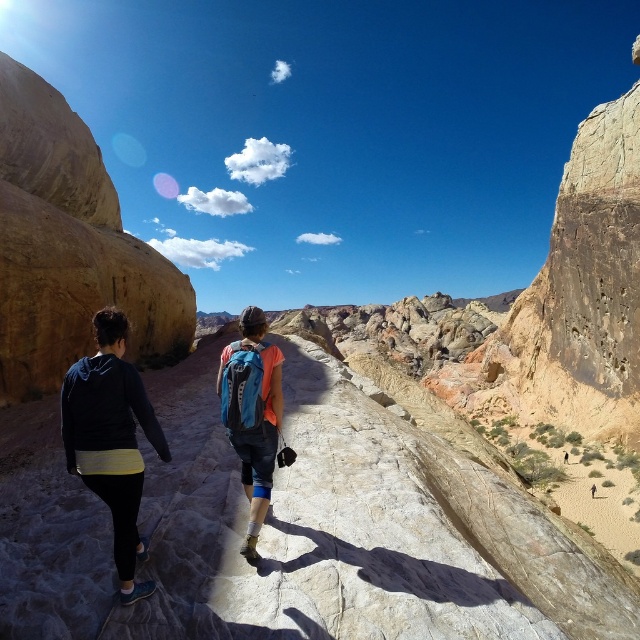
Question: Is dark blue fleece at center wider than blue fabric backpack at center?

Choices:
 (A) no
 (B) yes

Answer: (A)

Question: Estimate the real-world distances between objects in this image. Which object is closer to the dark blue fleece at center?

Choices:
 (A) matte blue backpack at center
 (B) blue fabric backpack at center

Answer: (A)

Question: Which object is positioned closest to the matte blue backpack at center?

Choices:
 (A) blue fabric backpack at center
 (B) dark blue fleece at center

Answer: (B)

Question: Is matte blue backpack at center below blue fabric backpack at center?

Choices:
 (A) yes
 (B) no

Answer: (A)

Question: Which object is closer to the camera taking this photo?

Choices:
 (A) blue fabric backpack at center
 (B) matte blue backpack at center

Answer: (B)

Question: Does dark blue fleece at center come in front of blue fabric backpack at center?

Choices:
 (A) yes
 (B) no

Answer: (A)